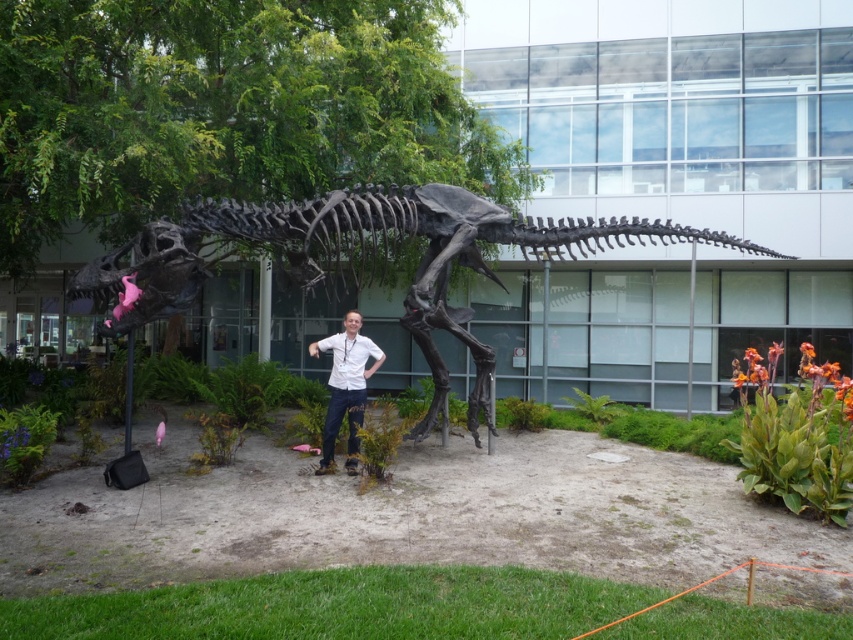
Is shiny metallic dinosaur skeleton at center bigger than white matte shirt at center?

No, shiny metallic dinosaur skeleton at center is not bigger than white matte shirt at center.

Is point (219, 224) closer to camera compared to point (358, 412)?

Yes, point (219, 224) is closer to viewer.

Locate an element on the screen. The width and height of the screenshot is (853, 640). shiny metallic dinosaur skeleton at center is located at coordinates (363, 259).

Locate an element on the screen. shiny metallic dinosaur skeleton at center is located at coordinates (363, 259).